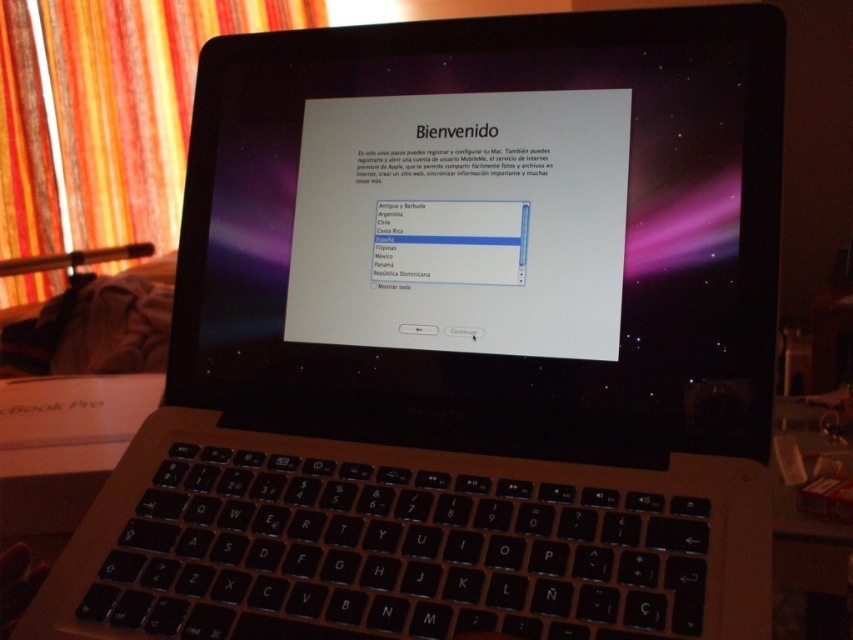
Looking at this image, you are setting up your new MacBook Pro and notice the orange fabric curtain at left and the black plastic keyboard at lower center. Which object is taller in the image?

The orange fabric curtain at left has a greater height compared to the black plastic keyboard at lower center, so the orange fabric curtain at left is taller.

You are setting up your new MacBook Pro and need to determine if the two points on the screen, point 1 at coordinates point (10, 24) and point 2 at coordinates point (804, 408), are at the same distance from you. Based on the setup screen displayed, can you confirm if both points are equally distant from your viewpoint?

Point (10, 24) is further to the viewer than point (804, 408), so they are not equally distant from your viewpoint.

You are setting up your new MacBook Pro and notice the orange fabric curtain at left and the black plastic keyboard at lower center. Which object takes up more space in the image?

The orange fabric curtain at left is larger in size than the black plastic keyboard at lower center, so it takes up more space in the image.